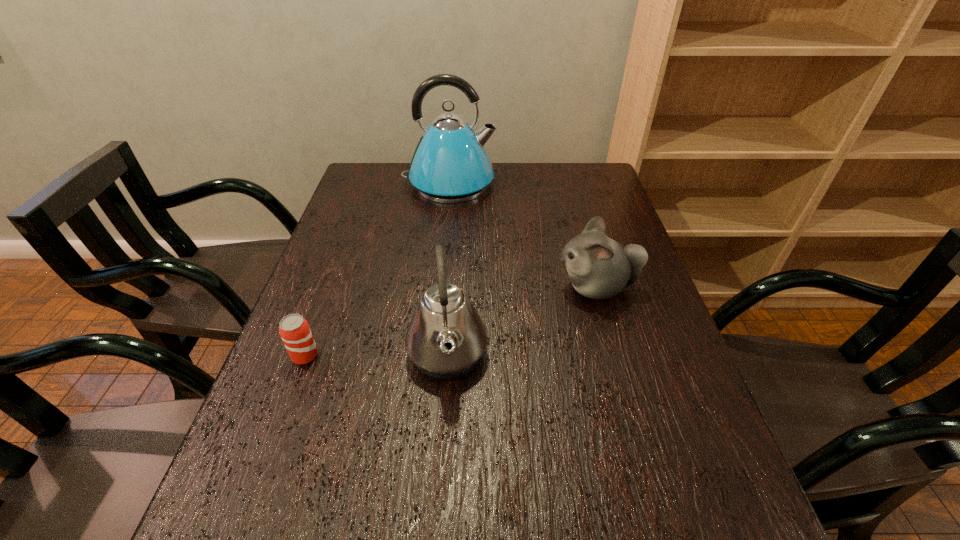
At what (x,y) coordinates should I click in order to perform the action: click on the farthest object. Please return your answer as a coordinate pair (x, y). This screenshot has height=540, width=960. Looking at the image, I should click on (450, 164).

At what (x,y) coordinates should I click in order to perform the action: click on the taller kettle. Please return your answer as a coordinate pair (x, y). The image size is (960, 540). Looking at the image, I should click on (450, 164).

I want to click on the shorter kettle, so click(446, 338).

Locate an element on the screen. The image size is (960, 540). the nearer kettle is located at coordinates (446, 338).

Where is `the rightmost object`? the rightmost object is located at coordinates click(x=598, y=267).

I want to click on hamster, so click(x=598, y=267).

Find the location of a particular element. The image size is (960, 540). beer can is located at coordinates (294, 330).

This screenshot has height=540, width=960. I want to click on the leftmost object, so click(x=294, y=330).

At what (x,y) coordinates should I click in order to perform the action: click on free location located at the spout of the taller kettle. Please return your answer as a coordinate pair (x, y). Looking at the image, I should click on (563, 184).

You are a GUI agent. You are given a task and a screenshot of the screen. Output one action in this format:
    pyautogui.click(x=<x>, y=<y>)
    Task: Click on the vacant space located on the right of the nearer kettle
    
    Given the screenshot: What is the action you would take?
    pyautogui.click(x=567, y=355)